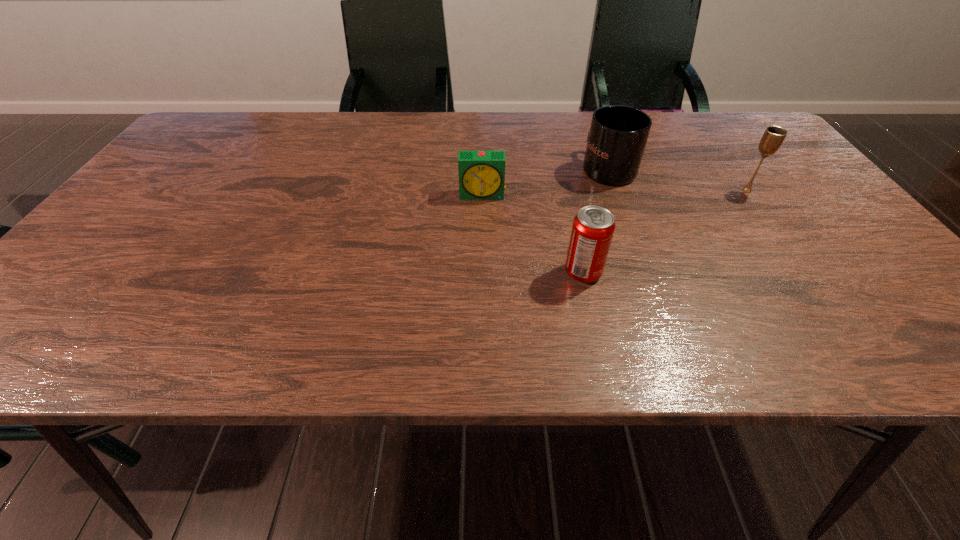
Where is `free space between the shortest object and the second object from left to right`? The image size is (960, 540). free space between the shortest object and the second object from left to right is located at coordinates (533, 233).

At what (x,y) coordinates should I click in order to perform the action: click on free space between the second object from left to right and the rightmost object. Please return your answer as a coordinate pair (x, y). This screenshot has height=540, width=960. Looking at the image, I should click on (665, 232).

Find the location of a particular element. The width and height of the screenshot is (960, 540). empty location between the chalice and the alarm clock is located at coordinates (614, 193).

Identify the location of free space between the chalice and the shortest object. click(614, 193).

Identify the location of vacant point located between the leftmost object and the chalice. (614, 193).

Where is `free space between the leftmost object and the chalice`? This screenshot has width=960, height=540. free space between the leftmost object and the chalice is located at coordinates (614, 193).

Identify which object is the third nearest to the alarm clock. Please provide its 2D coordinates. Your answer should be formatted as a tuple, i.e. [(x, y)], where the tuple contains the x and y coordinates of a point satisfying the conditions above.

[(773, 137)]

Identify the location of object that is the third closest to the third object from left to right. (593, 227).

At what (x,y) coordinates should I click in order to perform the action: click on vacant space that satisfies the following two spatial constraints: 1. on the front-facing side of the alarm clock; 2. on the left side of the soda can. Please return your answer as a coordinate pair (x, y). This screenshot has height=540, width=960. Looking at the image, I should click on (483, 272).

Where is `vacant region that satisfies the following two spatial constraints: 1. on the back side of the chalice; 2. on the left side of the third object from right to left`? The image size is (960, 540). vacant region that satisfies the following two spatial constraints: 1. on the back side of the chalice; 2. on the left side of the third object from right to left is located at coordinates (564, 191).